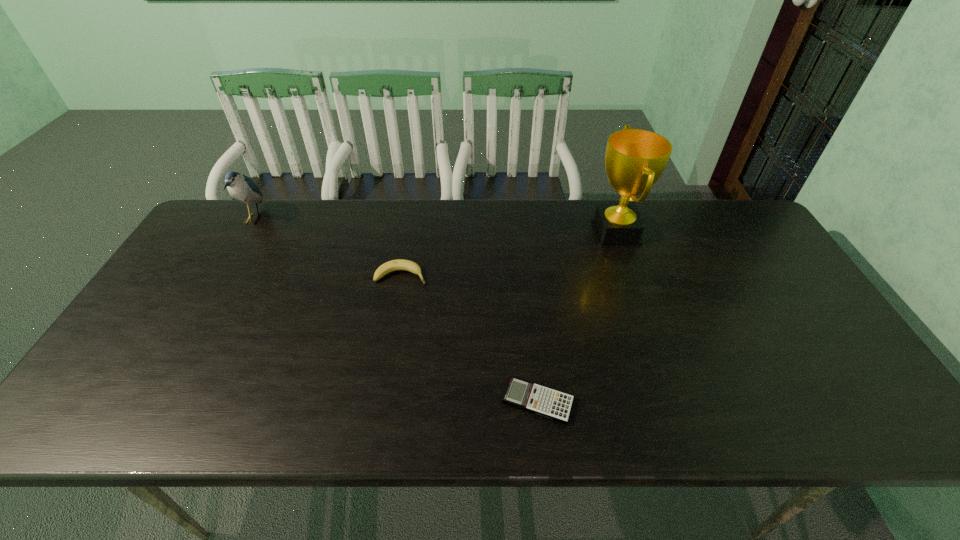
Identify the location of the tallest object. (635, 159).

Where is `the rightmost object`? the rightmost object is located at coordinates (635, 159).

The image size is (960, 540). What are the coordinates of `bird` in the screenshot? It's located at coord(242,188).

Locate an element on the screen. the third shortest object is located at coordinates click(x=242, y=188).

This screenshot has width=960, height=540. In order to click on the third farthest object in this screenshot , I will do `click(400, 264)`.

Locate an element on the screen. the second shortest object is located at coordinates (400, 264).

The width and height of the screenshot is (960, 540). I want to click on the nearest object, so click(x=543, y=401).

Locate an element on the screen. the third object from left to right is located at coordinates (543, 401).

Identify the location of free spot located 0.400m on the front-facing side of the award. The image size is (960, 540). (464, 232).

This screenshot has width=960, height=540. Identify the location of free space located 0.180m on the front-facing side of the award. (533, 232).